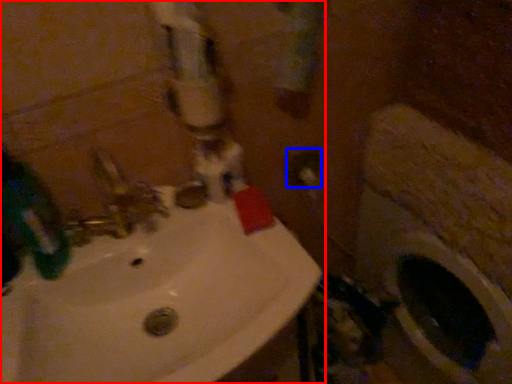
Question: Which point is further to the camera, sink (highlighted by a red box) or electric outlet (highlighted by a blue box)?

Choices:
 (A) sink
 (B) electric outlet

Answer: (B)